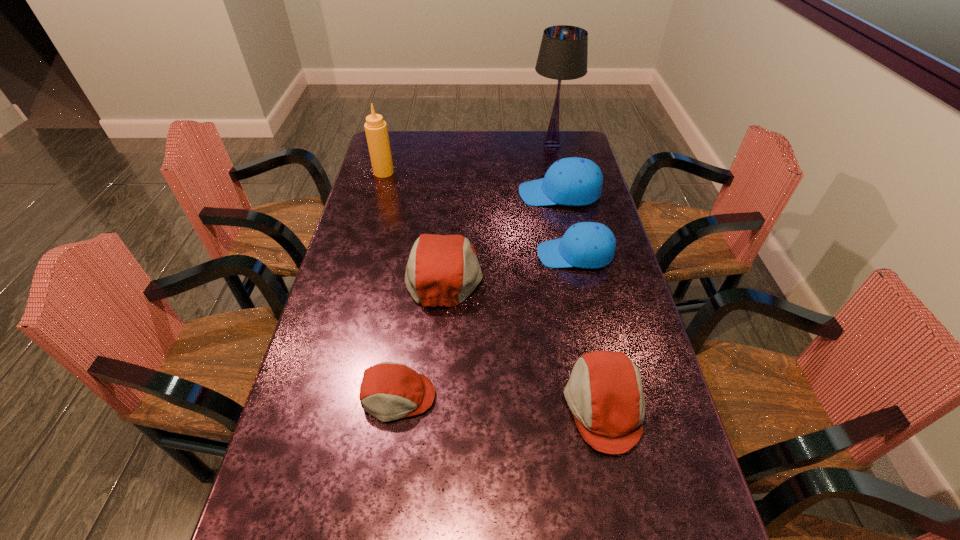
Locate an element on the screen. blank area located on the front-facing side of the smaller blue cap is located at coordinates (455, 254).

The height and width of the screenshot is (540, 960). I want to click on vacant area located on the front-facing side of the smaller blue cap, so click(x=468, y=254).

You are a GUI agent. You are given a task and a screenshot of the screen. Output one action in this format:
    pyautogui.click(x=<x>, y=<y>)
    Task: Click on the free space located on the front-facing side of the second biggest red cap
    This screenshot has height=540, width=960.
    Given the screenshot: What is the action you would take?
    pyautogui.click(x=501, y=406)

You are a GUI agent. You are given a task and a screenshot of the screen. Output one action in this format:
    pyautogui.click(x=<x>, y=<y>)
    Task: Click on the vacant space located 0.240m on the front-facing side of the second biggest red cap
    The image size is (960, 540).
    Given the screenshot: What is the action you would take?
    pyautogui.click(x=463, y=406)

Find the location of a particular element. The width and height of the screenshot is (960, 540). free space located 0.230m on the front-facing side of the second biggest red cap is located at coordinates point(467,406).

Find the location of a particular element. Image resolution: width=960 pixels, height=540 pixels. blank space located on the front-facing side of the smallest red cap is located at coordinates (380, 520).

Find the location of a particular element. The height and width of the screenshot is (540, 960). object present at the far edge is located at coordinates 563,53.

Image resolution: width=960 pixels, height=540 pixels. Find the location of `condiment situated at the left edge`. condiment situated at the left edge is located at coordinates (376, 131).

The width and height of the screenshot is (960, 540). Identify the location of cap that is at the left edge. (389, 391).

Identify the location of lampshade positioned at the right edge. The height and width of the screenshot is (540, 960). (563, 53).